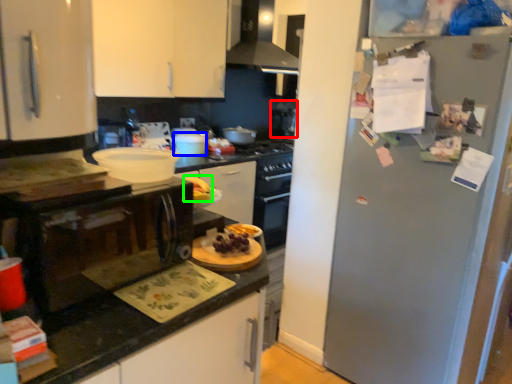
Question: Which object is the farthest from appliance (highlighted by a red box)? Choose among these: appliance (highlighted by a blue box) or food (highlighted by a green box).

Choices:
 (A) appliance
 (B) food

Answer: (B)